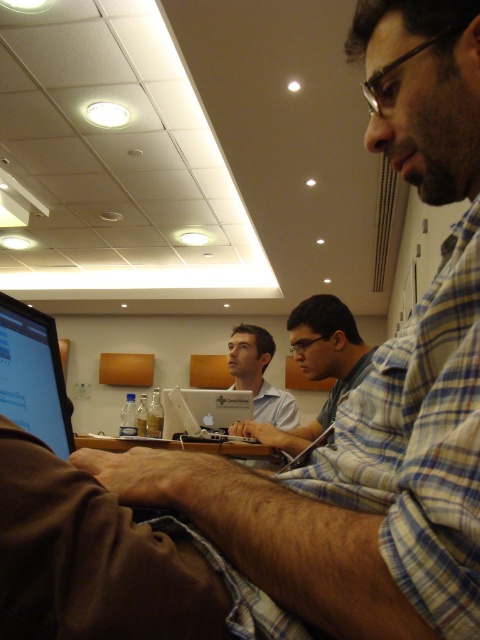
You are standing at the camera position and want to place a 6 feet long banner between you and the point at point (300,356). Will the banner fit without overlapping the point?

The distance between the camera and point (300,356) is 5.99 feet. Since the banner is 6 feet long, it will slightly exceed the available space, causing the end of the banner to overlap the point.

You are standing in the conference room and see two points marked on the ceiling tiles. The first point is at coordinate point (38, 426) and the second is at point (224, 403). Which point is closer to you?

Point (38, 426) is in front of point (224, 403), so it is closer to you.

You are a person sitting at a table in a conference room. You want to reach for the matte black laptop at left without moving your chair. Can you comfortably reach it if your arms can extend 24 inches in front of you?

The matte black laptop at left is 22.08 inches away from the viewer, so yes, you can comfortably reach it since your arms can extend 24 inches, which is longer than the distance.